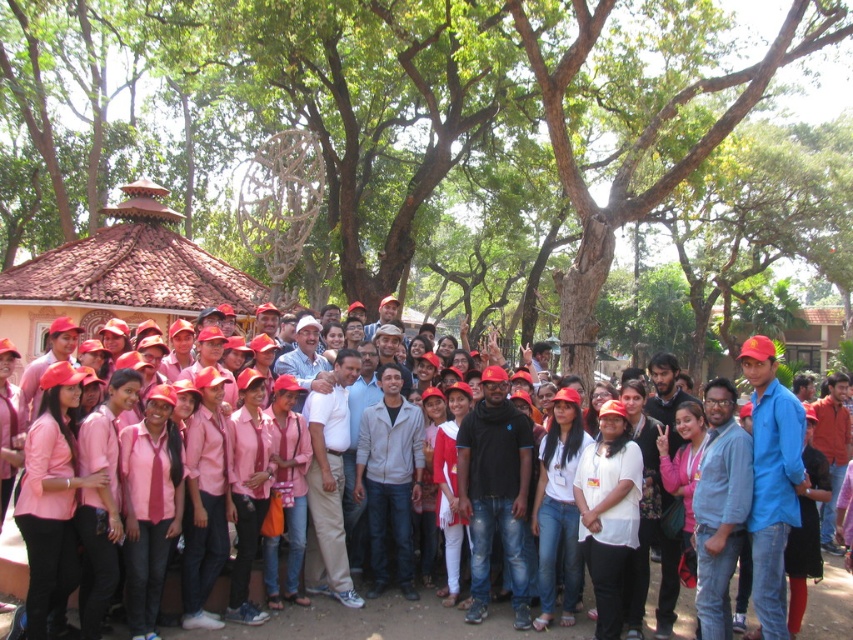
Question: Does green leafy tree at center have a greater width compared to pink fabric shirt at center?

Choices:
 (A) no
 (B) yes

Answer: (B)

Question: Which of the following is the farthest from the observer?

Choices:
 (A) (505, 624)
 (B) (544, 81)

Answer: (B)

Question: Observing the image, what is the correct spatial positioning of green leafy tree at center in reference to pink fabric shirt at center?

Choices:
 (A) above
 (B) below

Answer: (A)

Question: Which object is farther from the camera taking this photo?

Choices:
 (A) green leafy tree at center
 (B) pink fabric shirt at center

Answer: (A)

Question: Is green leafy tree at center positioned at the back of pink fabric shirt at center?

Choices:
 (A) no
 (B) yes

Answer: (B)